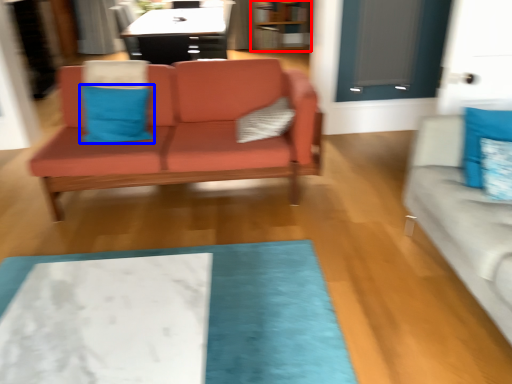
Question: Which of the following is the closest to the observer, bookshelf (highlighted by a red box) or pillow (highlighted by a blue box)?

Choices:
 (A) bookshelf
 (B) pillow

Answer: (B)